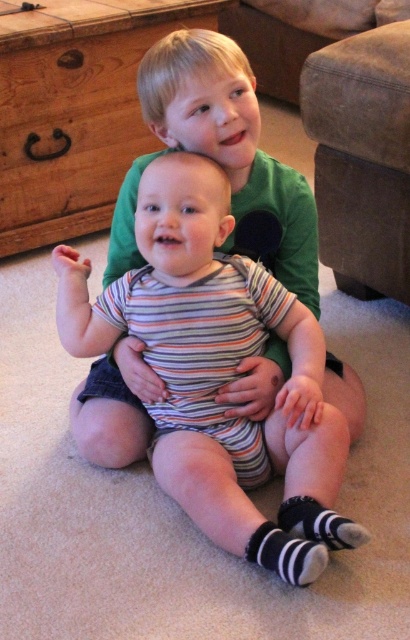
You are a parent trying to match socks for your children. You find two socks at lower center on the carpet. One is black striped sock at lower center and the other is striped fabric sock at lower center. Which sock is thinner?

The black striped sock at lower center is thinner than the striped fabric sock at lower center.

You are standing in the living room and see two points marked in the image. The first point is at coordinates point (x=334, y=468) and the second is at point (x=209, y=4). Which point is closer to you?

Point (x=334, y=468) is closer to the viewer than point (x=209, y=4).

You are a parent trying to choose between buying a striped fabric baby at center and a striped fabric sock at lower center for your child. Based on the image, which item is wider?

The striped fabric baby at center is wider than the striped fabric sock at lower center.